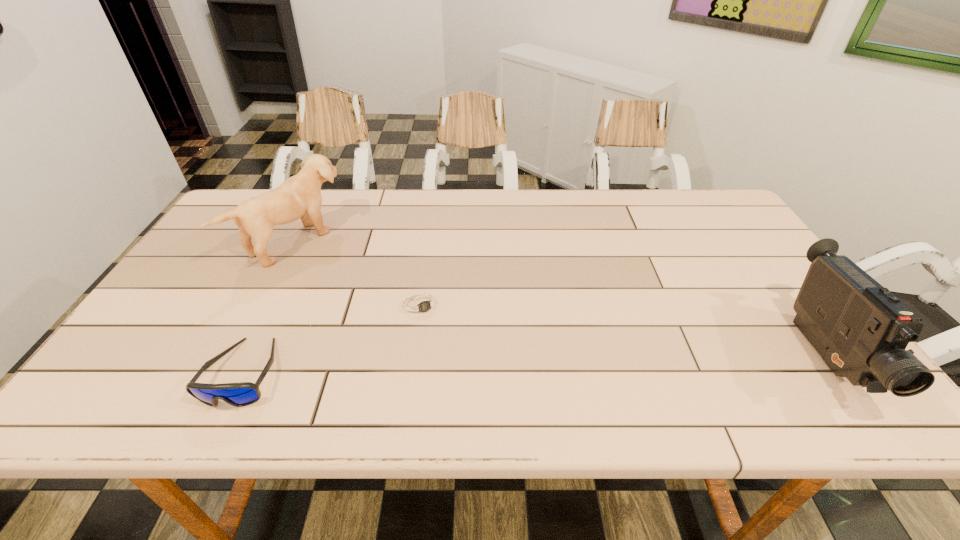
Identify the location of vacant space at the right edge of the desktop. (716, 258).

Locate an element on the screen. blank space at the far left corner is located at coordinates (252, 196).

Where is `vacant area at the far right corner`? vacant area at the far right corner is located at coordinates (694, 213).

This screenshot has height=540, width=960. I want to click on free space between the rightmost object and the puppy, so click(561, 299).

At what (x,y) coordinates should I click in order to perform the action: click on free space between the second object from right to left and the sunglasses. Please return your answer as a coordinate pair (x, y). Image resolution: width=960 pixels, height=540 pixels. Looking at the image, I should click on (333, 339).

This screenshot has width=960, height=540. Find the location of `unoccupied position between the rightmost object and the puppy`. unoccupied position between the rightmost object and the puppy is located at coordinates [x=561, y=299].

Locate an element on the screen. The image size is (960, 540). blank region between the second shortest object and the camcorder is located at coordinates (534, 364).

At what (x,y) coordinates should I click in order to perform the action: click on vacant region between the camcorder and the sunglasses. Please return your answer as a coordinate pair (x, y). The height and width of the screenshot is (540, 960). Looking at the image, I should click on (534, 364).

This screenshot has width=960, height=540. I want to click on free spot between the puppy and the shortest object, so click(360, 273).

This screenshot has height=540, width=960. I want to click on free space between the sunglasses and the shortest object, so click(x=333, y=339).